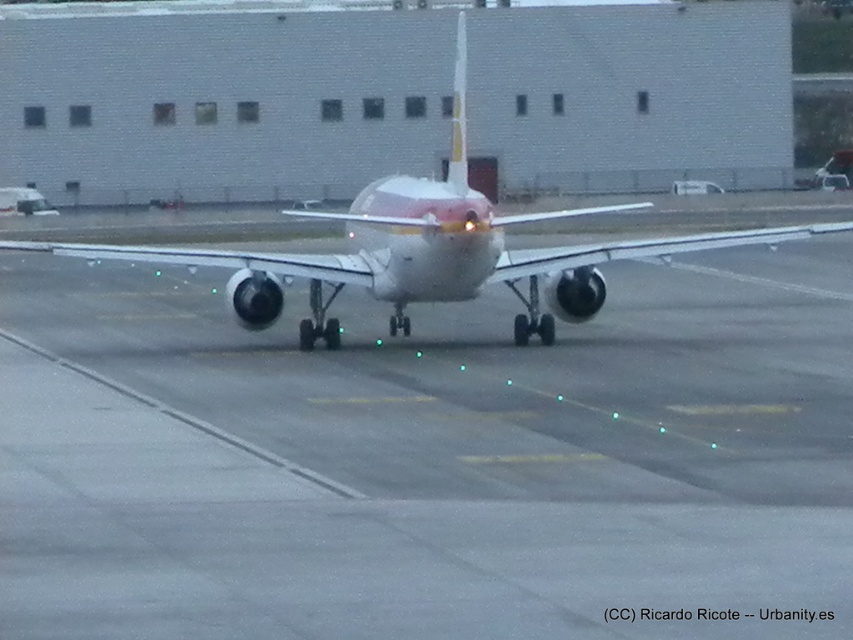
What are the coordinates of the gray asphalt runway at center?

The gray asphalt runway at center is located at coordinates point (427, 458).

You are a pilot trying to determine the runway distance available for takeoff. Based on the image, is the white glossy airplane at center positioned on the gray asphalt runway at center or behind it?

The gray asphalt runway at center is in front of the white glossy airplane at center, so the airplane is not positioned on the runway but behind it.